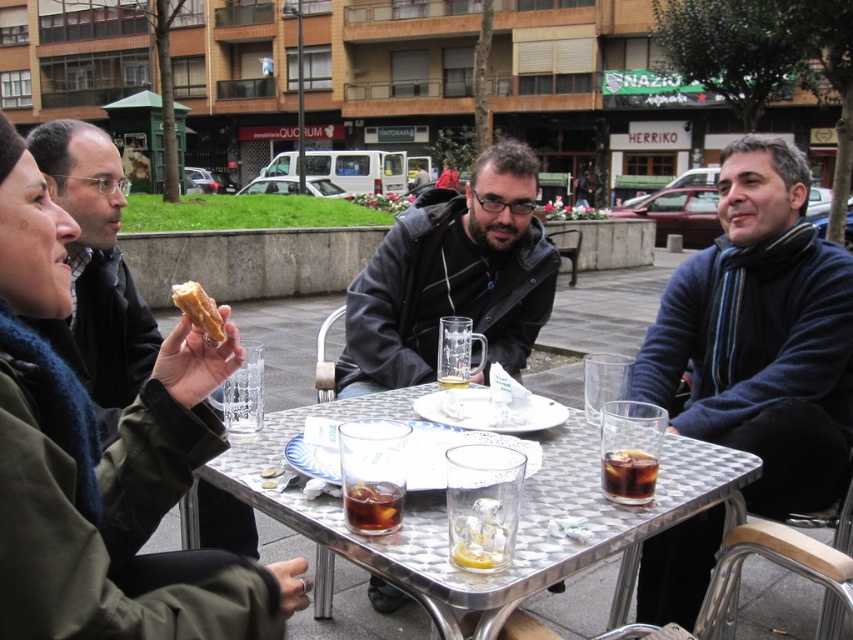
You are taking a photo of the outdoor gathering and want to focus on the two points in the image. Which point, point (380, 513) or point (648, 470), is closer to your camera?

Point (380, 513) is closer to the camera than point (648, 470).

You are at a cafe table with two drinks in front of you. You want to grab the dark amber liquid at center to take a sip. Is it closer to you than the dark brown glass at table center?

The dark amber liquid at center is in front of the dark brown glass at table center, meaning it is closer to you than the dark brown glass at table center. Yes, it is closer.

You are a barista at the outdoor cafe. You need to prepare a drink for a customer who wants something with a smaller volume than the golden crispy pastry at upper left. Can you use the dark amber liquid at center for this request?

The dark amber liquid at center has a smaller size compared to the golden crispy pastry at upper left. Yes, you can use the dark amber liquid at center because its volume is smaller than the pastry.